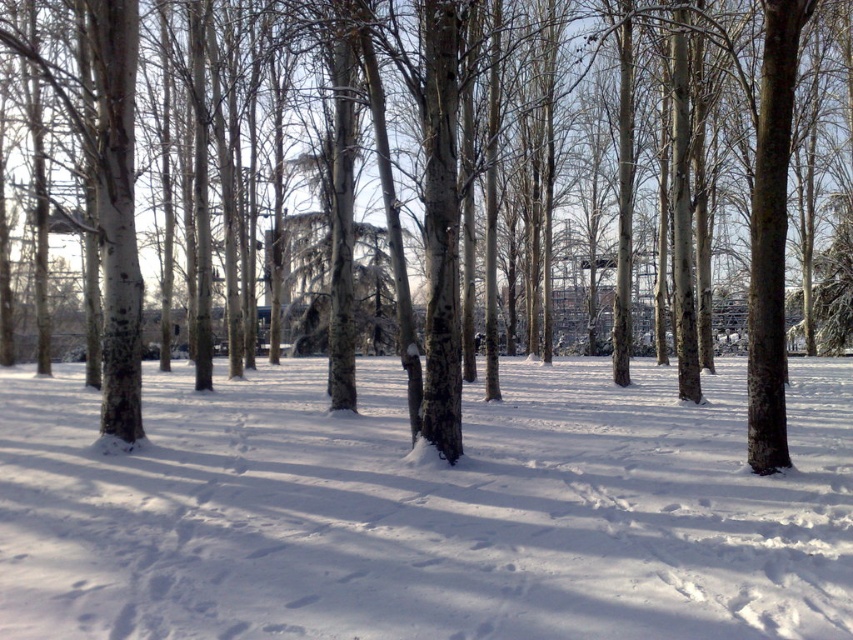
You are standing in the winter park scene. There is a point marked at coordinates (425, 509). What is located at that point?

At point (425, 509) lies white powdery snow at center.

You are an artist trying to sketch this winter scene. You want to ensure the white powdery snow at center and the brown bark tree at center are proportionally accurate. Which object should you draw larger in your sketch?

The brown bark tree at center should be drawn larger because it occupies more space than the white powdery snow at center.

You are standing at the point marked as point (169, 506) in the winter scene. You want to walk straight ahead to a snowdrift that is 40 feet away. Will you reach the snowdrift before the structure in the background?

The distance between you and the viewer is 30.01 feet, which is less than the 40 feet to the snowdrift. Therefore, you will reach the structure in the background before the snowdrift.